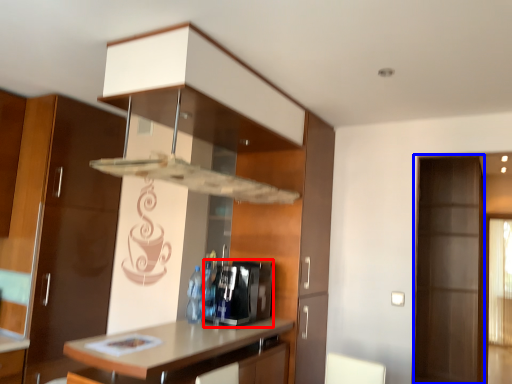
Question: Which object is closer to the camera taking this photo, appliance (highlighted by a red box) or screen door (highlighted by a blue box)?

Choices:
 (A) appliance
 (B) screen door

Answer: (A)